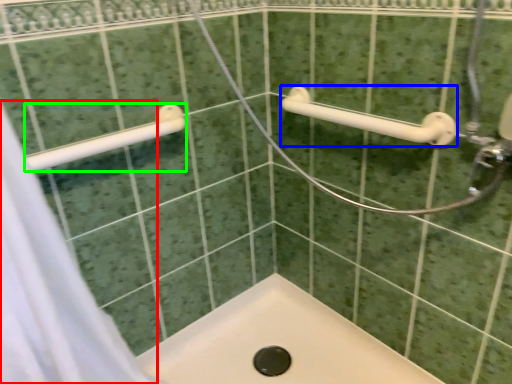
Question: Based on their relative distances, which object is farther from shower curtain (highlighted by a red box)? Choose from towel rack (highlighted by a blue box) and towel rack (highlighted by a green box).

Choices:
 (A) towel rack
 (B) towel rack

Answer: (A)